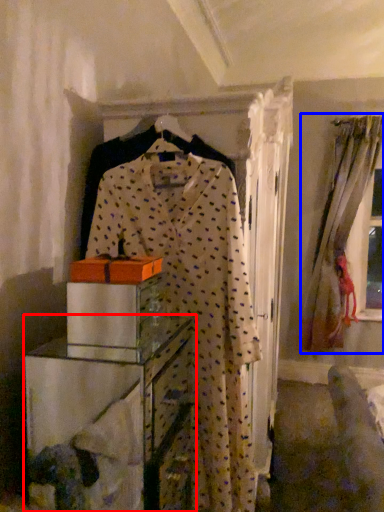
Question: Which object appears farthest to the camera in this image, furniture (highlighted by a red box) or window (highlighted by a blue box)?

Choices:
 (A) furniture
 (B) window

Answer: (B)